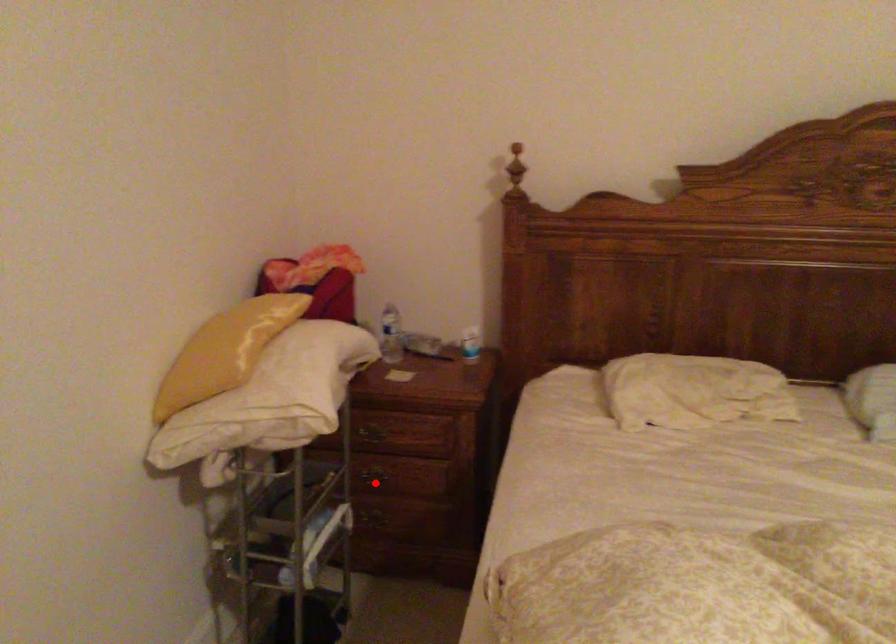
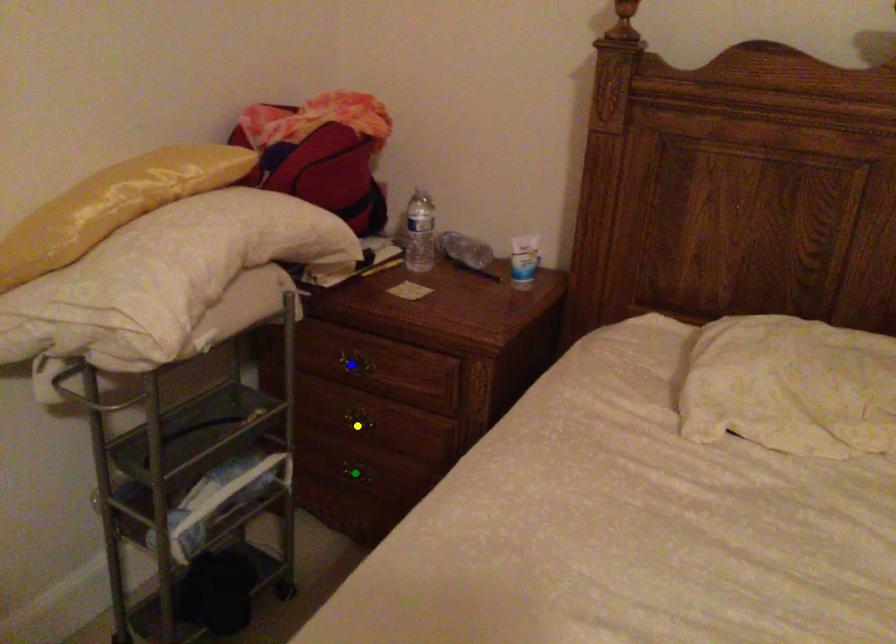
Question: I am providing you with two images of the same scene from different viewpoints. A red point is marked on the first image. You are given multiple points on the second image. Can you choose the point in image 2 that corresponds to the point in image 1?

Choices:
 (A) blue point
 (B) green point
 (C) yellow point

Answer: (C)